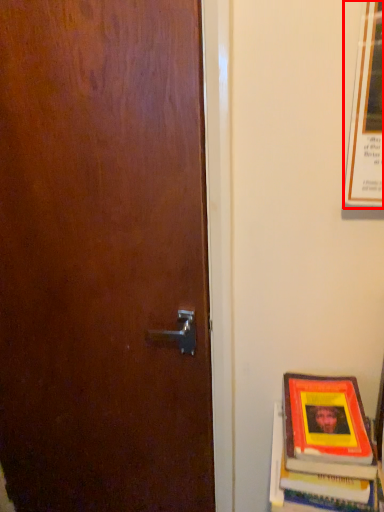
Question: In this image, where is poster (annotated by the red box) located relative to book?

Choices:
 (A) left
 (B) right

Answer: (B)